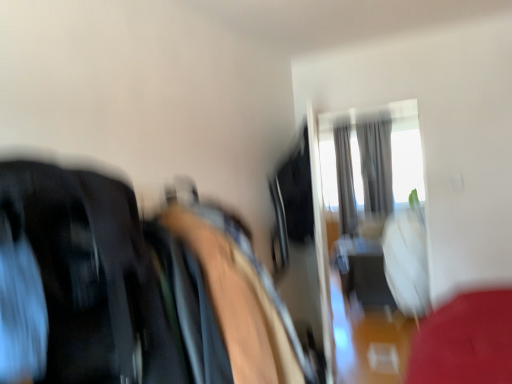
Find the location of a particular element. dark fabric clothes at left is located at coordinates (132, 289).

Where is `transparent glass door at upper center`? The image size is (512, 384). transparent glass door at upper center is located at coordinates (370, 238).

Find the location of a particular element. gray fabric curtain at upper right, which appears as the 2th curtain when viewed from the left is located at coordinates (376, 165).

Is transparent glass door at upper center in contact with silky gray curtain at upper center, placed as the 2th curtain when sorted from right to left?

No, transparent glass door at upper center is not next to silky gray curtain at upper center, placed as the 2th curtain when sorted from right to left.

From the image's perspective, which is below, transparent glass door at upper center or silky gray curtain at upper center, acting as the 1th curtain starting from the left?

transparent glass door at upper center.

Considering the sizes of objects transparent glass door at upper center and silky gray curtain at upper center, placed as the 2th curtain when sorted from right to left, in the image provided, who is wider, transparent glass door at upper center or silky gray curtain at upper center, placed as the 2th curtain when sorted from right to left,?

With larger width is silky gray curtain at upper center, placed as the 2th curtain when sorted from right to left.

Is dark fabric clothes at left not near transparent glass door at upper center?

Yes, dark fabric clothes at left is far from transparent glass door at upper center.

The height and width of the screenshot is (384, 512). What are the coordinates of `laundry below the transparent glass door at upper center (from the image's perspective)` in the screenshot? It's located at (132, 289).

In the image, is dark fabric clothes at left on the left side or the right side of transparent glass door at upper center?

In the image, dark fabric clothes at left appears on the left side of transparent glass door at upper center.

Is dark fabric clothes at left taller than transparent glass door at upper center?

No, dark fabric clothes at left is not taller than transparent glass door at upper center.

Considering the sizes of silky gray curtain at upper center, placed as the 2th curtain when sorted from right to left, and dark fabric clothes at left in the image, is silky gray curtain at upper center, placed as the 2th curtain when sorted from right to left, wider or thinner than dark fabric clothes at left?

Clearly, silky gray curtain at upper center, placed as the 2th curtain when sorted from right to left, has less width compared to dark fabric clothes at left.

From a real-world perspective, is silky gray curtain at upper center, acting as the 1th curtain starting from the left, positioned under dark fabric clothes at left based on gravity?

Actually, silky gray curtain at upper center, acting as the 1th curtain starting from the left, is physically above dark fabric clothes at left in the real world.

From the image's perspective, which object appears higher, silky gray curtain at upper center, acting as the 1th curtain starting from the left, or dark fabric clothes at left?

From the image's view, silky gray curtain at upper center, acting as the 1th curtain starting from the left, is above.

Considering the relative positions of silky gray curtain at upper center, acting as the 1th curtain starting from the left, and dark fabric clothes at left in the image provided, is silky gray curtain at upper center, acting as the 1th curtain starting from the left, to the left or to the right of dark fabric clothes at left?

silky gray curtain at upper center, acting as the 1th curtain starting from the left, is positioned on dark fabric clothes at left's right side.

Who is bigger, transparent glass door at upper center or gray fabric curtain at upper right, the 1th curtain from the right?

gray fabric curtain at upper right, the 1th curtain from the right, is bigger.

From a real-world perspective, is transparent glass door at upper center below gray fabric curtain at upper right, which appears as the 2th curtain when viewed from the left?

Yes, from a real-world perspective, transparent glass door at upper center is under gray fabric curtain at upper right, which appears as the 2th curtain when viewed from the left.

How far apart are transparent glass door at upper center and gray fabric curtain at upper right, the 1th curtain from the right?

transparent glass door at upper center is 1.74 meters from gray fabric curtain at upper right, the 1th curtain from the right.

Where is `curtain that is the 2nd object located behind the beige fabric bean bag chair at center`? The image size is (512, 384). curtain that is the 2nd object located behind the beige fabric bean bag chair at center is located at coordinates (345, 181).

Is beige fabric bean bag chair at center located outside silky gray curtain at upper center, placed as the 2th curtain when sorted from right to left?

Yes, beige fabric bean bag chair at center is located beyond the bounds of silky gray curtain at upper center, placed as the 2th curtain when sorted from right to left.

Looking at their sizes, would you say beige fabric bean bag chair at center is wider or thinner than silky gray curtain at upper center, acting as the 1th curtain starting from the left?

In the image, beige fabric bean bag chair at center appears to be wider than silky gray curtain at upper center, acting as the 1th curtain starting from the left.

Where is `curtain that is the 2nd one when counting rightward from the dark fabric clothes at left`? The image size is (512, 384). curtain that is the 2nd one when counting rightward from the dark fabric clothes at left is located at coordinates (376, 165).

Between gray fabric curtain at upper right, the 1th curtain from the right, and dark fabric clothes at left, which one has smaller width?

gray fabric curtain at upper right, the 1th curtain from the right.

Is gray fabric curtain at upper right, which appears as the 2th curtain when viewed from the left, oriented away from dark fabric clothes at left?

That's not correct — gray fabric curtain at upper right, which appears as the 2th curtain when viewed from the left, is not looking away from dark fabric clothes at left.

Is point (380, 141) behind point (223, 269)?

Yes, point (380, 141) is farther from viewer.

Does transparent glass door at upper center lie in front of beige fabric bean bag chair at center?

No, transparent glass door at upper center is further to the viewer.

Is transparent glass door at upper center wider than beige fabric bean bag chair at center?

In fact, transparent glass door at upper center might be narrower than beige fabric bean bag chair at center.

Is transparent glass door at upper center to the left or to the right of beige fabric bean bag chair at center in the image?

transparent glass door at upper center is to the right of beige fabric bean bag chair at center.

Identify the location of bean bag chair below the transparent glass door at upper center (from the image's perspective). (242, 298).

This screenshot has height=384, width=512. Find the location of `glass door located below the silky gray curtain at upper center, placed as the 2th curtain when sorted from right to left (from the image's perspective)`. glass door located below the silky gray curtain at upper center, placed as the 2th curtain when sorted from right to left (from the image's perspective) is located at coordinates (370, 238).

The image size is (512, 384). In order to click on laundry above the transparent glass door at upper center (from a real-world perspective) in this screenshot , I will do `click(132, 289)`.

From the image, which object appears to be nearer to gray fabric curtain at upper right, the 1th curtain from the right, beige fabric bean bag chair at center or transparent glass door at upper center?

transparent glass door at upper center is positioned closer to the anchor gray fabric curtain at upper right, the 1th curtain from the right.

Which object lies further to the anchor point silky gray curtain at upper center, acting as the 1th curtain starting from the left, dark fabric clothes at left or beige fabric bean bag chair at center?

Among the two, dark fabric clothes at left is located further to silky gray curtain at upper center, acting as the 1th curtain starting from the left.

Which object lies nearer to the anchor point beige fabric bean bag chair at center, dark fabric clothes at left or silky gray curtain at upper center, acting as the 1th curtain starting from the left?

Based on the image, dark fabric clothes at left appears to be nearer to beige fabric bean bag chair at center.

Considering their positions, is transparent glass door at upper center positioned closer to silky gray curtain at upper center, acting as the 1th curtain starting from the left, than gray fabric curtain at upper right, which appears as the 2th curtain when viewed from the left?

Based on the image, gray fabric curtain at upper right, which appears as the 2th curtain when viewed from the left, appears to be nearer to silky gray curtain at upper center, acting as the 1th curtain starting from the left.

Which object lies further to the anchor point dark fabric clothes at left, gray fabric curtain at upper right, which appears as the 2th curtain when viewed from the left, or beige fabric bean bag chair at center?

gray fabric curtain at upper right, which appears as the 2th curtain when viewed from the left, is further to dark fabric clothes at left.

When comparing their distances from dark fabric clothes at left, does beige fabric bean bag chair at center or gray fabric curtain at upper right, which appears as the 2th curtain when viewed from the left, seem further?

Among the two, gray fabric curtain at upper right, which appears as the 2th curtain when viewed from the left, is located further to dark fabric clothes at left.

Looking at the image, which one is located further to silky gray curtain at upper center, placed as the 2th curtain when sorted from right to left, transparent glass door at upper center or beige fabric bean bag chair at center?

beige fabric bean bag chair at center.

Considering their positions, is transparent glass door at upper center positioned closer to beige fabric bean bag chair at center than gray fabric curtain at upper right, which appears as the 2th curtain when viewed from the left?

transparent glass door at upper center.

This screenshot has height=384, width=512. Identify the location of curtain located between transparent glass door at upper center and silky gray curtain at upper center, acting as the 1th curtain starting from the left, in the depth direction. (376, 165).

Find the location of `curtain located between beige fabric bean bag chair at center and silky gray curtain at upper center, acting as the 1th curtain starting from the left, in the depth direction`. curtain located between beige fabric bean bag chair at center and silky gray curtain at upper center, acting as the 1th curtain starting from the left, in the depth direction is located at coordinates (376, 165).

Where is `bean bag chair positioned between dark fabric clothes at left and gray fabric curtain at upper right, which appears as the 2th curtain when viewed from the left, from near to far`? The height and width of the screenshot is (384, 512). bean bag chair positioned between dark fabric clothes at left and gray fabric curtain at upper right, which appears as the 2th curtain when viewed from the left, from near to far is located at coordinates (242, 298).

At what (x,y) coordinates should I click in order to perform the action: click on bean bag chair positioned between dark fabric clothes at left and silky gray curtain at upper center, acting as the 1th curtain starting from the left, from near to far. Please return your answer as a coordinate pair (x, y). Image resolution: width=512 pixels, height=384 pixels. Looking at the image, I should click on (242, 298).